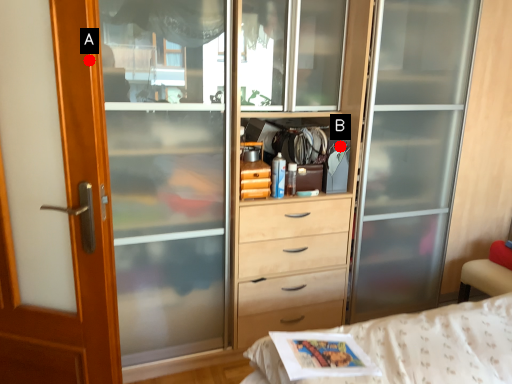
Question: Two points are circled on the image, labeled by A and B beside each circle. Which point is closer to the camera?

Choices:
 (A) A is closer
 (B) B is closer

Answer: (A)